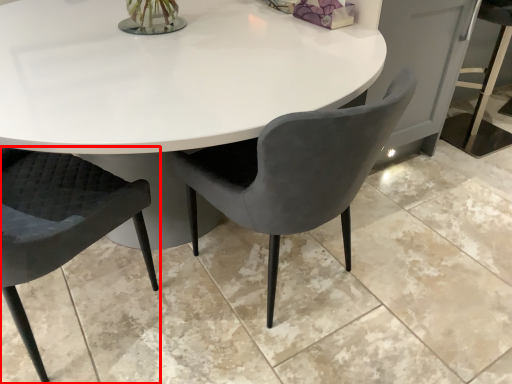
Question: From the image's perspective, what is the correct spatial relationship of chair (annotated by the red box) in relation to chair?

Choices:
 (A) below
 (B) above

Answer: (A)